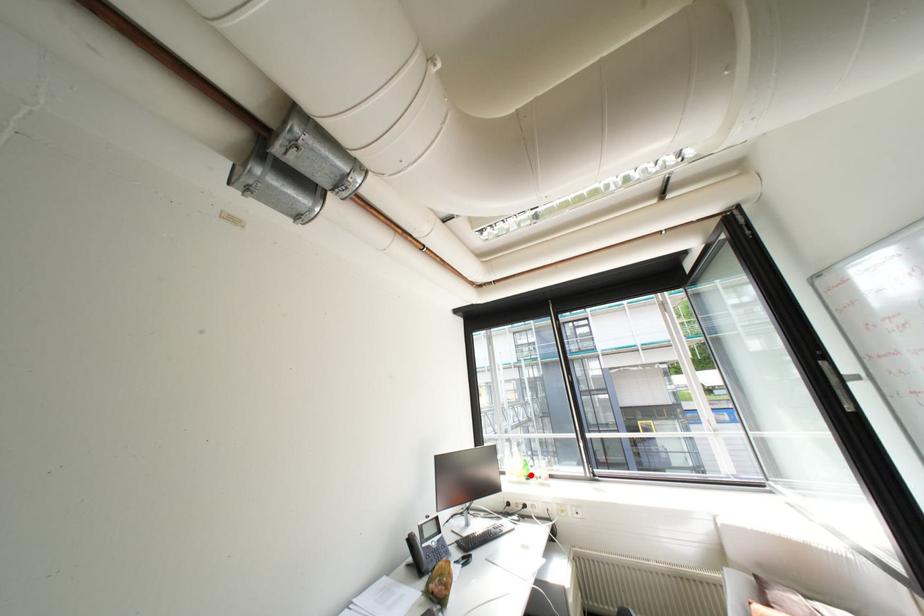
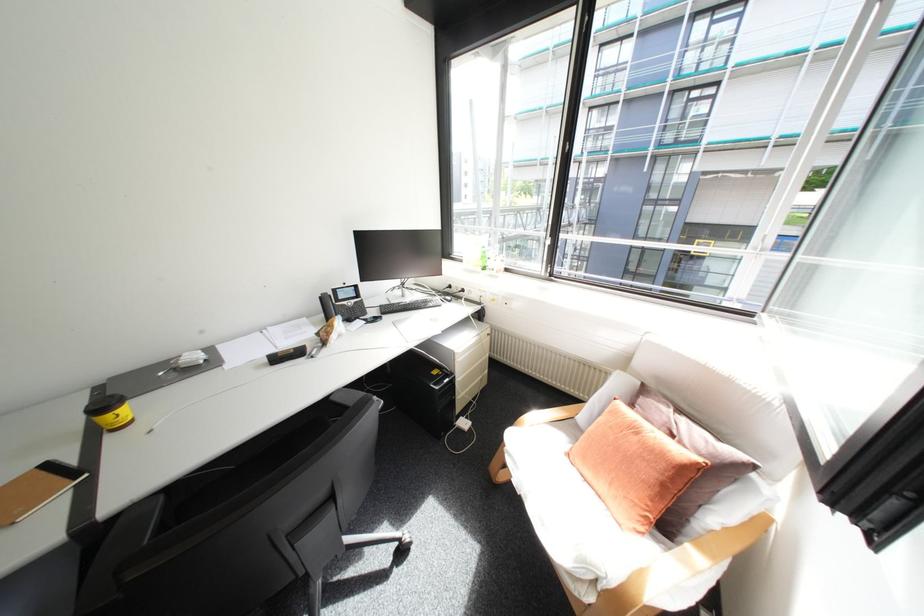
Find the pixel in the second image that matches the highlighted location in the first image.

(487, 265)